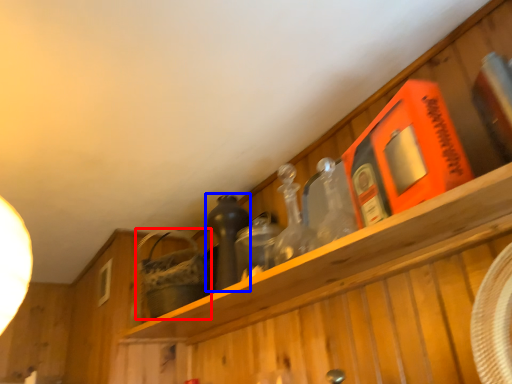
Question: Among these objects, which one is nearest to the camera, basket (highlighted by a red box) or bottle (highlighted by a blue box)?

Choices:
 (A) basket
 (B) bottle

Answer: (B)